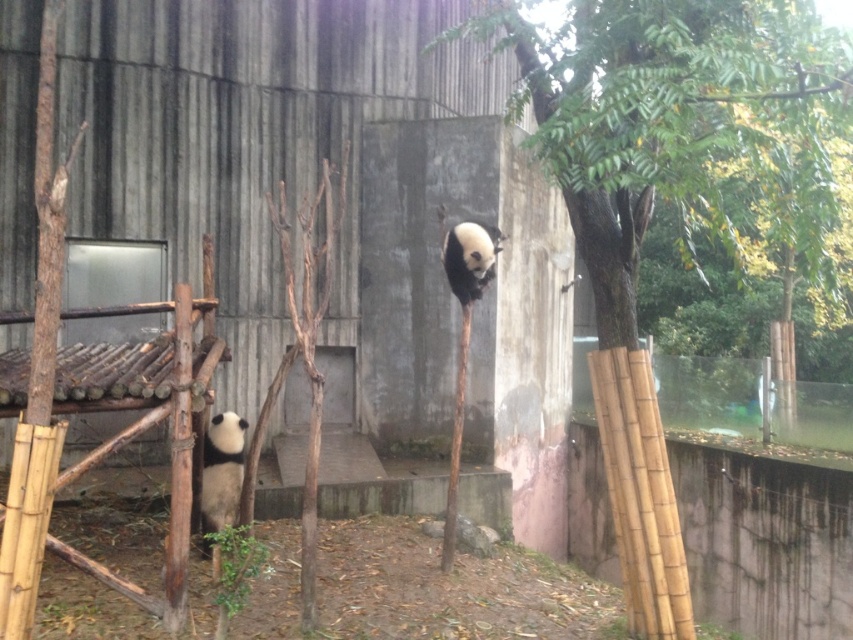
Question: Can you confirm if green leafy tree at upper right is positioned to the left of black and white fur panda at lower left?

Choices:
 (A) yes
 (B) no

Answer: (B)

Question: Among these objects, which one is farthest from the camera?

Choices:
 (A) white fur panda at upper center
 (B) green leafy tree at upper right

Answer: (A)

Question: Does green leafy tree at upper right have a smaller size compared to white fur panda at upper center?

Choices:
 (A) yes
 (B) no

Answer: (B)

Question: Which point appears closest to the camera in this image?

Choices:
 (A) (830, 70)
 (B) (469, 284)

Answer: (A)

Question: Can you confirm if green leafy tree at upper right is wider than white fur panda at upper center?

Choices:
 (A) yes
 (B) no

Answer: (A)

Question: Which object is closer to the camera taking this photo?

Choices:
 (A) white fur panda at upper center
 (B) green leafy tree at upper right

Answer: (B)